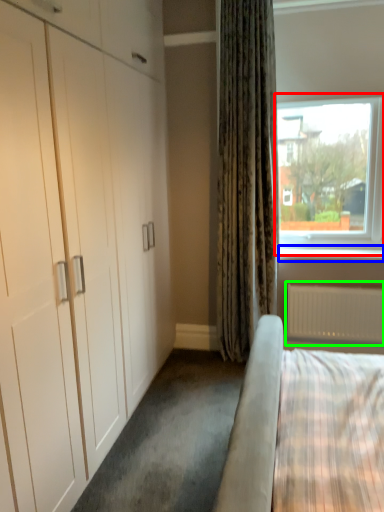
Question: Which is nearer to the window (highlighted by a red box)? window sill (highlighted by a blue box) or radiator (highlighted by a green box).

Choices:
 (A) window sill
 (B) radiator

Answer: (A)